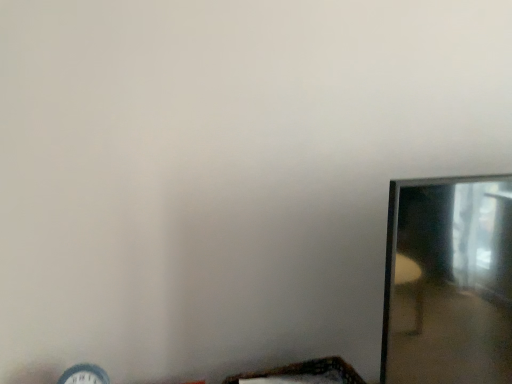
Question: Should I look upward or downward to see wooden woven basket at lower center?

Choices:
 (A) up
 (B) down

Answer: (B)

Question: Is matte white clock at lower left in front of clear glass mirror at right?

Choices:
 (A) no
 (B) yes

Answer: (A)

Question: Is matte white clock at lower left at the left side of clear glass mirror at right?

Choices:
 (A) yes
 (B) no

Answer: (A)

Question: Could you tell me if matte white clock at lower left is facing clear glass mirror at right?

Choices:
 (A) yes
 (B) no

Answer: (B)

Question: Is matte white clock at lower left oriented away from clear glass mirror at right?

Choices:
 (A) yes
 (B) no

Answer: (B)

Question: From the image's perspective, would you say matte white clock at lower left is positioned over clear glass mirror at right?

Choices:
 (A) no
 (B) yes

Answer: (A)

Question: Would you say clear glass mirror at right is part of matte white clock at lower left's contents?

Choices:
 (A) yes
 (B) no

Answer: (B)

Question: Is matte white clock at lower left in contact with wooden woven basket at lower center?

Choices:
 (A) yes
 (B) no

Answer: (B)

Question: From the image's perspective, does matte white clock at lower left appear higher than wooden woven basket at lower center?

Choices:
 (A) no
 (B) yes

Answer: (B)

Question: Does matte white clock at lower left have a lesser height compared to wooden woven basket at lower center?

Choices:
 (A) no
 (B) yes

Answer: (A)

Question: Are matte white clock at lower left and wooden woven basket at lower center located far from each other?

Choices:
 (A) yes
 (B) no

Answer: (B)

Question: Is matte white clock at lower left thinner than wooden woven basket at lower center?

Choices:
 (A) no
 (B) yes

Answer: (B)

Question: Is matte white clock at lower left wider than wooden woven basket at lower center?

Choices:
 (A) no
 (B) yes

Answer: (A)

Question: Does clear glass mirror at right have a greater height compared to matte white clock at lower left?

Choices:
 (A) no
 (B) yes

Answer: (B)